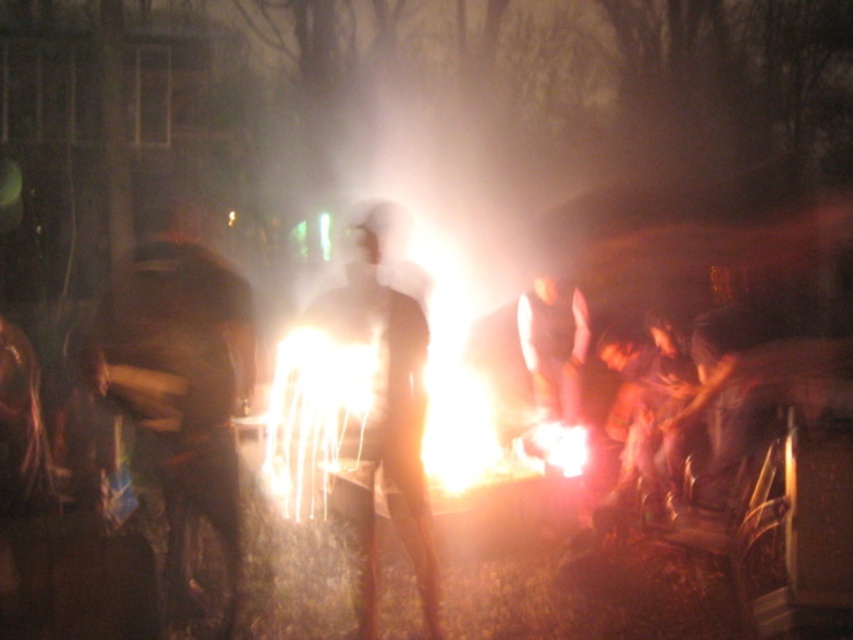
You are a photographer trying to capture the scene around the fire. You notice the dark brown leather jacket at left and the translucent white figure at center. Which object would appear smaller in your photo?

The dark brown leather jacket at left has a smaller size compared to the translucent white figure at center, so it would appear smaller in the photo.